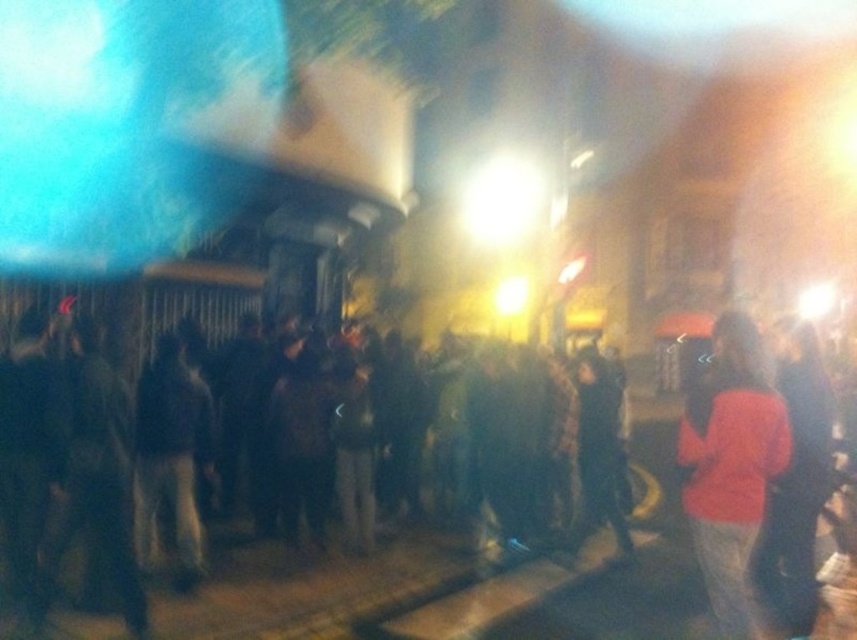
Can you confirm if dark matte clothing at center is positioned above orange fabric shirt at right?

Incorrect, dark matte clothing at center is not positioned above orange fabric shirt at right.

Locate an element on the screen. Image resolution: width=857 pixels, height=640 pixels. dark matte clothing at center is located at coordinates point(220,564).

Image resolution: width=857 pixels, height=640 pixels. Find the location of `dark matte clothing at center`. dark matte clothing at center is located at coordinates (220, 564).